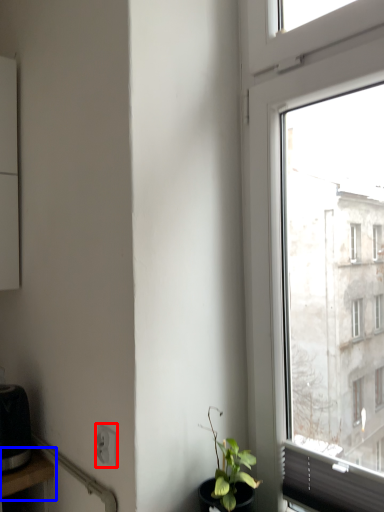
Question: Which of the following is the closest to the observer, power plugs and sockets (highlighted by a red box) or table (highlighted by a blue box)?

Choices:
 (A) power plugs and sockets
 (B) table

Answer: (A)